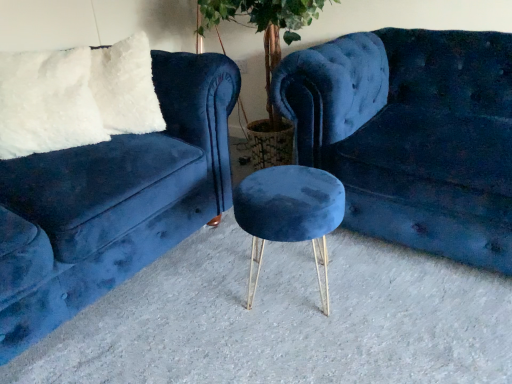
Question: Should I look upward or downward to see velvet blue stool at center?

Choices:
 (A) down
 (B) up

Answer: (A)

Question: Considering the relative sizes of velvet blue couch at left, the first studio couch when ordered from left to right, and velvet blue couch at center, arranged as the first studio couch when viewed from the right, in the image provided, is velvet blue couch at left, the first studio couch when ordered from left to right, bigger than velvet blue couch at center, arranged as the first studio couch when viewed from the right,?

Choices:
 (A) yes
 (B) no

Answer: (A)

Question: From a real-world perspective, is velvet blue couch at left, the second studio couch when ordered from right to left, under velvet blue couch at center, placed as the 2th studio couch when sorted from left to right?

Choices:
 (A) yes
 (B) no

Answer: (B)

Question: Does velvet blue couch at left, the first studio couch when ordered from left to right, have a smaller size compared to velvet blue couch at center, arranged as the first studio couch when viewed from the right?

Choices:
 (A) no
 (B) yes

Answer: (A)

Question: From the image's perspective, would you say velvet blue couch at left, the second studio couch when ordered from right to left, is shown under velvet blue couch at center, arranged as the first studio couch when viewed from the right?

Choices:
 (A) no
 (B) yes

Answer: (B)

Question: From the image's perspective, would you say velvet blue couch at left, the first studio couch when ordered from left to right, is positioned over velvet blue couch at center, placed as the 2th studio couch when sorted from left to right?

Choices:
 (A) yes
 (B) no

Answer: (B)

Question: Is velvet blue couch at left, the first studio couch when ordered from left to right, facing away from velvet blue couch at center, arranged as the first studio couch when viewed from the right?

Choices:
 (A) no
 (B) yes

Answer: (A)

Question: Is white fluffy pillow at upper left at the right side of velvet blue couch at center, arranged as the first studio couch when viewed from the right?

Choices:
 (A) yes
 (B) no

Answer: (B)

Question: Is white fluffy pillow at upper left completely or partially outside of velvet blue couch at center, placed as the 2th studio couch when sorted from left to right?

Choices:
 (A) no
 (B) yes

Answer: (B)

Question: Considering the relative sizes of white fluffy pillow at upper left and velvet blue couch at center, arranged as the first studio couch when viewed from the right, in the image provided, is white fluffy pillow at upper left shorter than velvet blue couch at center, arranged as the first studio couch when viewed from the right,?

Choices:
 (A) yes
 (B) no

Answer: (A)

Question: Does white fluffy pillow at upper left have a smaller size compared to velvet blue couch at center, placed as the 2th studio couch when sorted from left to right?

Choices:
 (A) no
 (B) yes

Answer: (B)

Question: From the image's perspective, does white fluffy pillow at upper left appear higher than velvet blue couch at center, arranged as the first studio couch when viewed from the right?

Choices:
 (A) no
 (B) yes

Answer: (B)

Question: Is the depth of white fluffy pillow at upper left greater than that of velvet blue couch at center, arranged as the first studio couch when viewed from the right?

Choices:
 (A) yes
 (B) no

Answer: (A)

Question: Is velvet blue couch at left, the second studio couch when ordered from right to left, aimed at velvet blue stool at center?

Choices:
 (A) yes
 (B) no

Answer: (A)